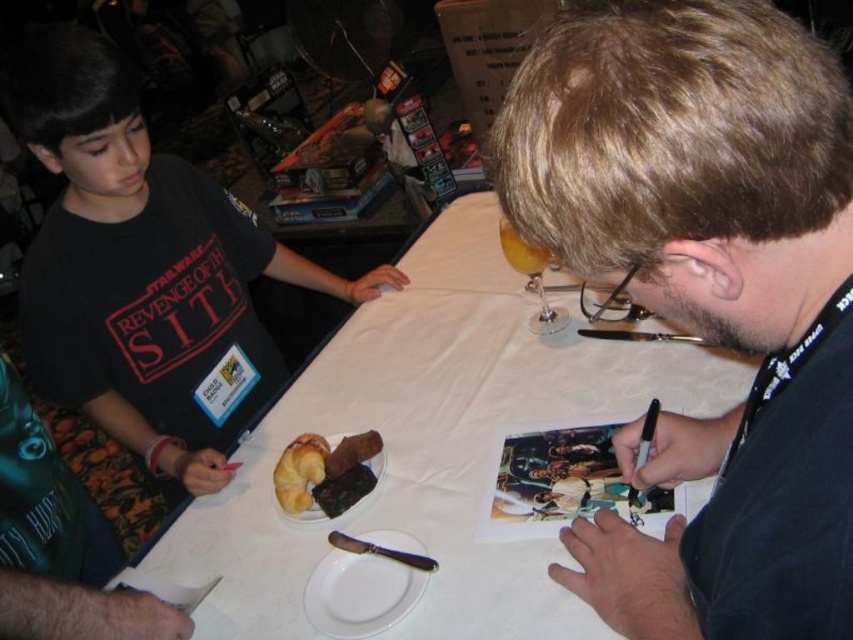
Is black matte pen at center to the right of matte black t-shirt at left from the viewer's perspective?

Indeed, black matte pen at center is positioned on the right side of matte black t-shirt at left.

Between black matte pen at center and matte black t-shirt at left, which one is positioned higher?

Positioned higher is matte black t-shirt at left.

Image resolution: width=853 pixels, height=640 pixels. What do you see at coordinates (706, 292) in the screenshot?
I see `black matte pen at center` at bounding box center [706, 292].

Where is `black matte pen at center`? Image resolution: width=853 pixels, height=640 pixels. black matte pen at center is located at coordinates (706, 292).

Who is taller, white paper at center or golden brown croissant at center?

white paper at center

I want to click on white paper at center, so click(x=433, y=444).

Does point (267, 605) come farther from viewer compared to point (310, 461)?

No, (267, 605) is in front of (310, 461).

In order to click on white paper at center in this screenshot , I will do `click(433, 444)`.

Does black matte pen at center have a lesser width compared to white paper at center?

Yes.

Is black matte pen at center shorter than white paper at center?

Yes, black matte pen at center is shorter than white paper at center.

What are the coordinates of `black matte pen at center` in the screenshot? It's located at (706, 292).